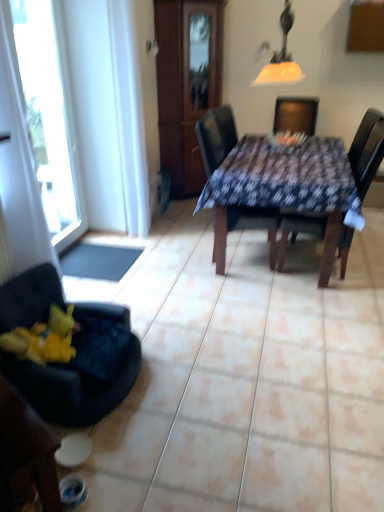
Question: Considering the positions of point (46, 489) and point (190, 169), is point (46, 489) closer or farther from the camera than point (190, 169)?

Choices:
 (A) closer
 (B) farther

Answer: (A)

Question: Looking at their shapes, would you say velvet dark blue chair at lower left, the fourth chair in the right-to-left sequence, is wider or thinner than wooden armoire at center?

Choices:
 (A) wide
 (B) thin

Answer: (B)

Question: Based on their relative distances, which object is nearer to the dark brown wooden chair at center, the first chair viewed from the right?

Choices:
 (A) yellow plush toy at lower left
 (B) matte yellow glass lampshade at upper center
 (C) transparent glass window at left
 (D) dark blue fabric-covered table at center
 (E) dark blue fabric chair at center, which appears as the 2th chair when viewed from the right

Answer: (D)

Question: Which object is the closest to the yellow plush toy at lower left?

Choices:
 (A) velvet black chair at lower left, the second chair from the left
 (B) dark blue fabric chair at center, which appears as the 2th chair when viewed from the right
 (C) matte yellow glass lampshade at upper center
 (D) velvet dark blue chair at lower left, placed as the first chair when sorted from left to right
 (E) dark brown wooden chair at center, the first chair viewed from the right

Answer: (A)